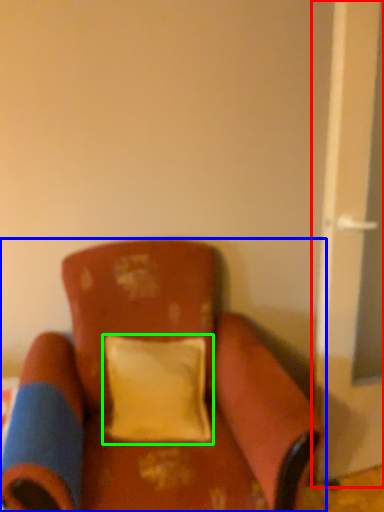
Question: Considering the real-world distances, which object is farthest from screen door (highlighted by a red box)? chair (highlighted by a blue box) or pillow (highlighted by a green box)?

Choices:
 (A) chair
 (B) pillow

Answer: (A)